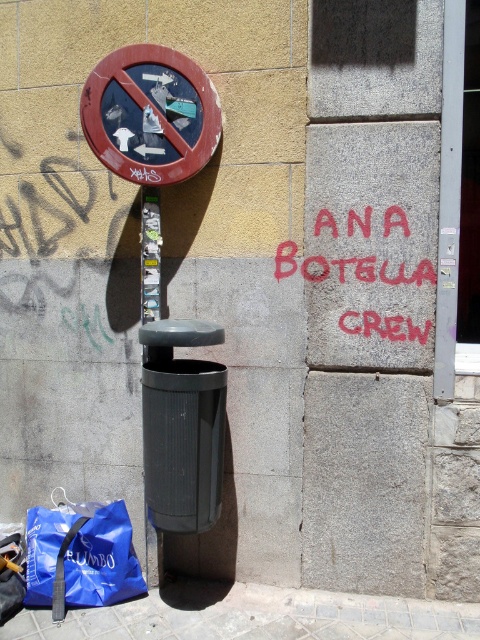
Question: Which of these objects is positioned farthest from the brushed metal pole at center?

Choices:
 (A) red graffiti at center
 (B) gray concrete pavement at lower center
 (C) blue fabric bag at lower left
 (D) red painted circular sign at upper left

Answer: (B)

Question: Which object is the farthest from the gray concrete pavement at lower center?

Choices:
 (A) brushed metal pole at center
 (B) red painted circular sign at upper left
 (C) blue fabric bag at lower left
 (D) red graffiti at center

Answer: (B)

Question: Is gray concrete pavement at lower center above red graffiti at center?

Choices:
 (A) no
 (B) yes

Answer: (A)

Question: Which of the following is the farthest from the observer?

Choices:
 (A) (144, 282)
 (B) (108, 109)
 (C) (392, 620)

Answer: (A)

Question: Considering the relative positions of blue fabric bag at lower left and red graffiti at center in the image provided, where is blue fabric bag at lower left located with respect to red graffiti at center?

Choices:
 (A) right
 (B) left

Answer: (B)

Question: Does gray concrete pavement at lower center appear over blue fabric bag at lower left?

Choices:
 (A) no
 (B) yes

Answer: (A)